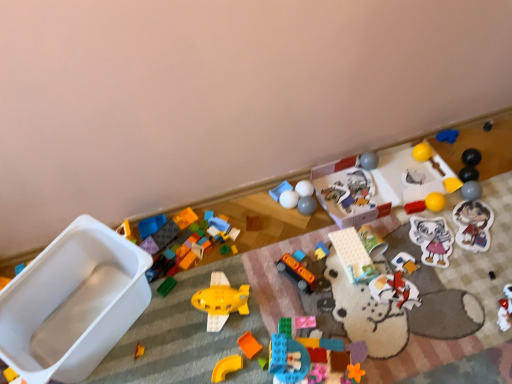
You are a GUI agent. You are given a task and a screenshot of the screen. Output one action in this format:
    pyautogui.click(x=<x>, y=<y>)
    Task: Click on the vacant space to the right of pink matte block at center, acting as the 14th toy starting from the right
    The height and width of the screenshot is (384, 512).
    Given the screenshot: What is the action you would take?
    pyautogui.click(x=358, y=319)